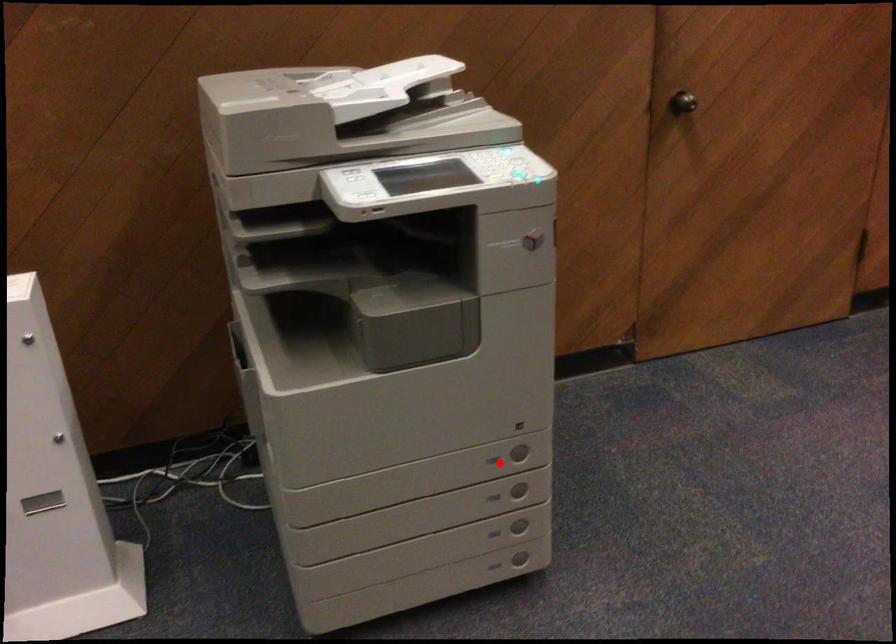
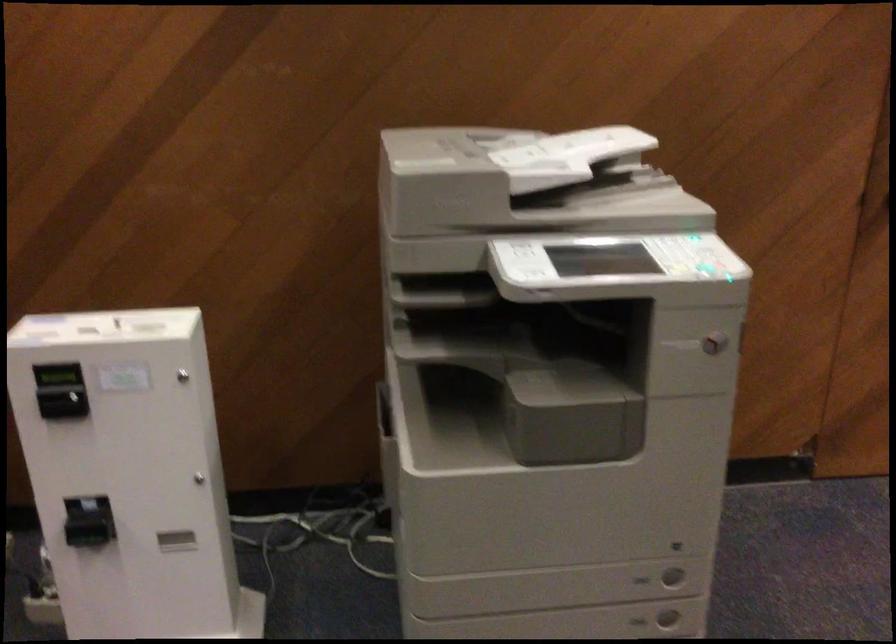
Where in the second image is the point corresponding to the highlighted location from the first image?

(642, 580)